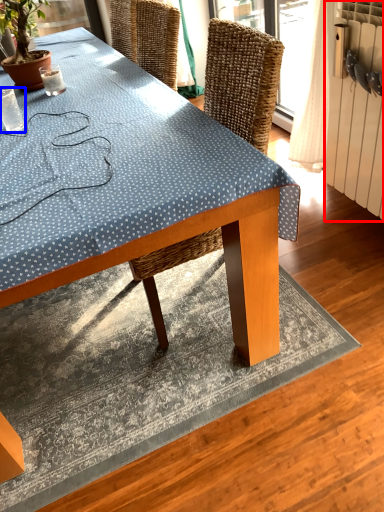
Question: Which of the following is the closest to the observer, radiator (highlighted by a red box) or coffee cup (highlighted by a blue box)?

Choices:
 (A) radiator
 (B) coffee cup

Answer: (A)